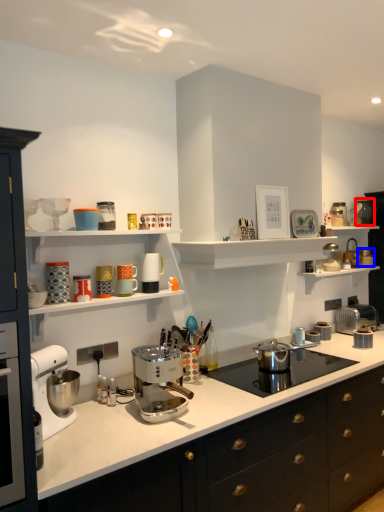
Question: Which of the following is the closest to the observer, appliance (highlighted by a red box) or appliance (highlighted by a blue box)?

Choices:
 (A) appliance
 (B) appliance

Answer: (A)